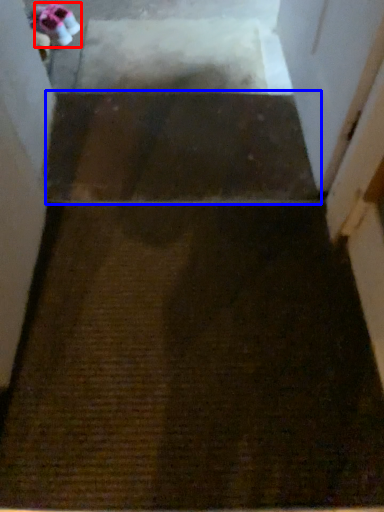
Question: Among these objects, which one is farthest to the camera, shoe (highlighted by a red box) or stairwell (highlighted by a blue box)?

Choices:
 (A) shoe
 (B) stairwell

Answer: (A)